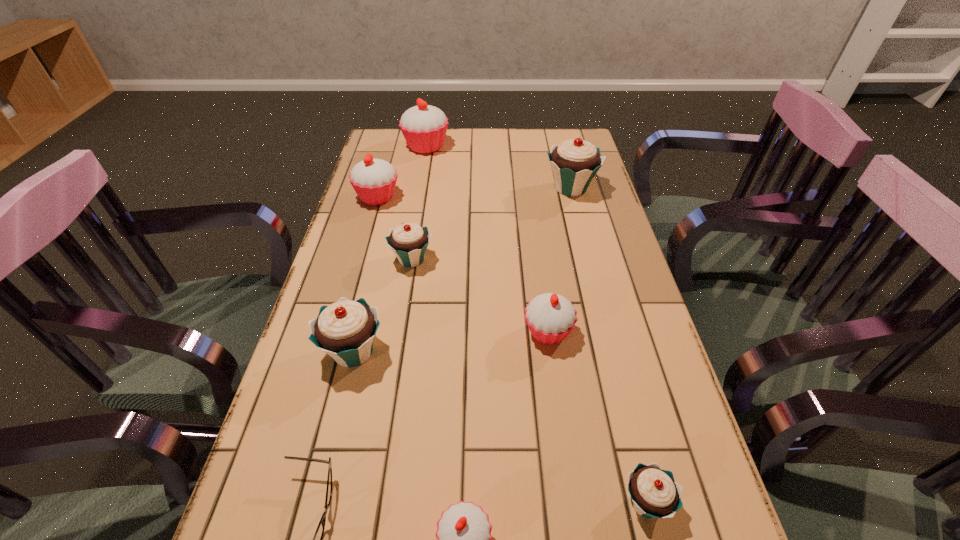
The image size is (960, 540). In order to click on vacant space at the left edge of the desktop in this screenshot , I will do `click(389, 217)`.

Where is `vacant region at the right edge of the desktop`? The image size is (960, 540). vacant region at the right edge of the desktop is located at coordinates (685, 470).

Where is `vacant space at the far right corner of the desktop`? vacant space at the far right corner of the desktop is located at coordinates coord(575,137).

Identify the location of blank region between the biggest teal cupcake and the rightmost pink cupcake. (560, 260).

Locate an element on the screen. Image resolution: width=960 pixels, height=540 pixels. free spot between the farthest object and the sixth nearest object is located at coordinates (419, 203).

This screenshot has height=540, width=960. What are the coordinates of `vacant area between the third farthest pink cupcake and the biggest teal cupcake` in the screenshot? It's located at (560, 260).

Identify the location of free space between the second nearest pink cupcake and the smallest teal cupcake. Image resolution: width=960 pixels, height=540 pixels. (597, 417).

The width and height of the screenshot is (960, 540). Identify the location of vacant area that lies between the third smallest teal cupcake and the nearest teal cupcake. (499, 427).

Find the location of `free spot between the third smallest teal cupcake and the farthest teal cupcake`. free spot between the third smallest teal cupcake and the farthest teal cupcake is located at coordinates (462, 270).

Find the location of a particular element. The height and width of the screenshot is (540, 960). empty space between the fourth farthest cupcake and the second biggest teal cupcake is located at coordinates (383, 306).